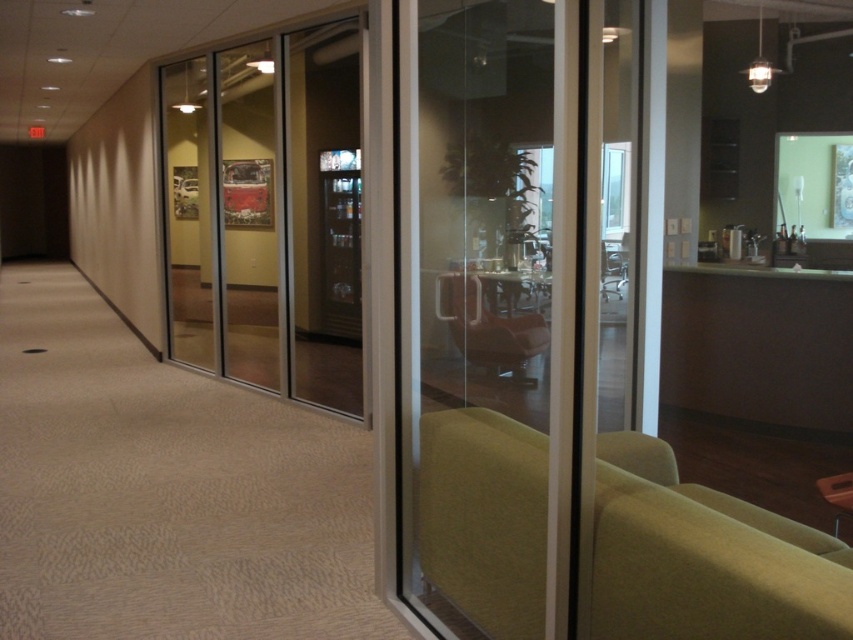
Question: Is clear glass door at center closer to camera compared to green fabric armchair at lower right?

Choices:
 (A) yes
 (B) no

Answer: (B)

Question: Among these points, which one is farthest from the camera?

Choices:
 (A) (444, 280)
 (B) (276, 163)
 (C) (447, 285)

Answer: (B)

Question: Which point appears farthest from the camera in this image?

Choices:
 (A) (554, 570)
 (B) (469, 269)
 (C) (260, 150)
 (D) (779, 579)

Answer: (C)

Question: Which point appears farthest from the camera in this image?

Choices:
 (A) (177, 294)
 (B) (506, 636)
 (C) (511, 486)

Answer: (A)

Question: Is green fabric armchair at lower right positioned before matte green armchair at center?

Choices:
 (A) no
 (B) yes

Answer: (B)

Question: Does clear glass door at center have a greater width compared to green fabric armchair at lower right?

Choices:
 (A) yes
 (B) no

Answer: (A)